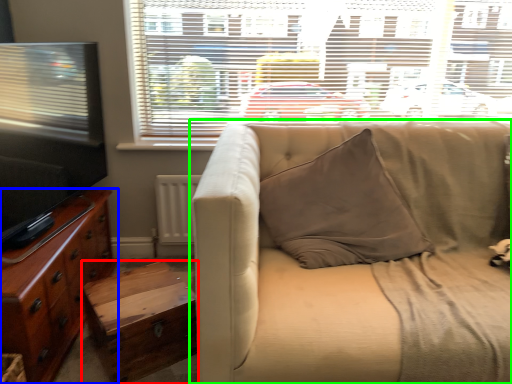
Question: Estimate the real-world distances between objects in this image. Which object is closer to table (highlighted by a red box), cabinetry (highlighted by a blue box) or studio couch (highlighted by a green box)?

Choices:
 (A) cabinetry
 (B) studio couch

Answer: (A)